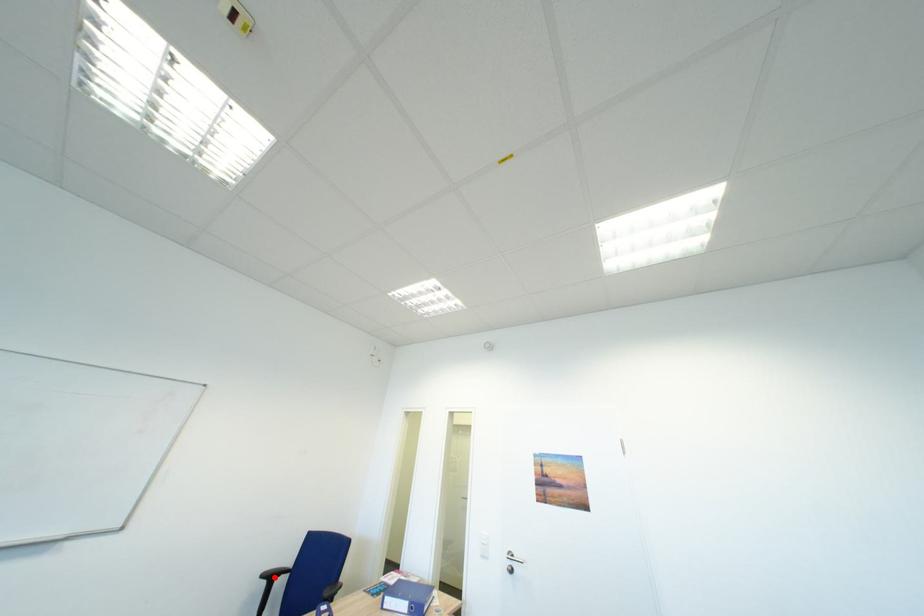
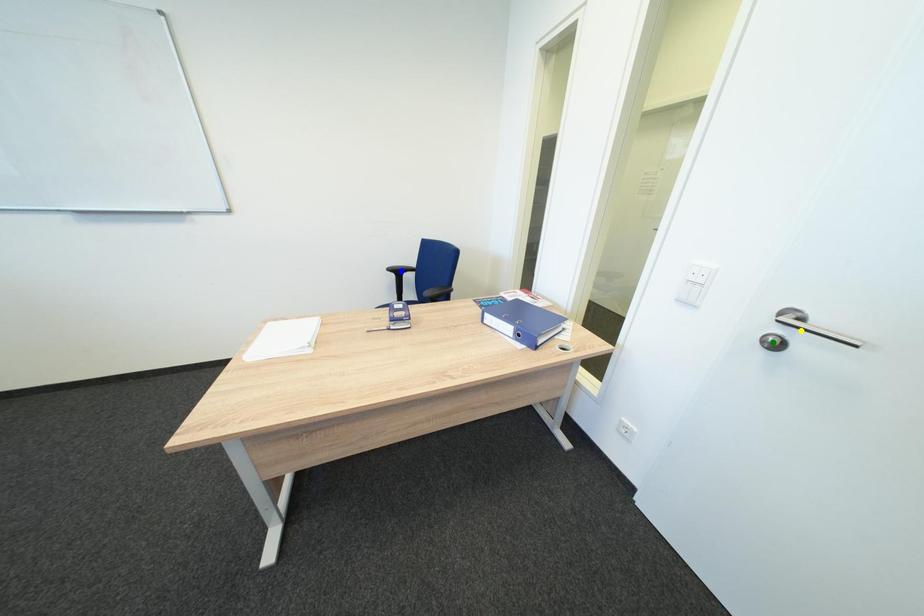
Question: I am providing you with two images of the same scene from different viewpoints. A red point is marked on the first image. You are given multiple points on the second image. Which point in image 2 represents the same 3d spot as the red point in image 1?

Choices:
 (A) yellow point
 (B) blue point
 (C) green point

Answer: (B)